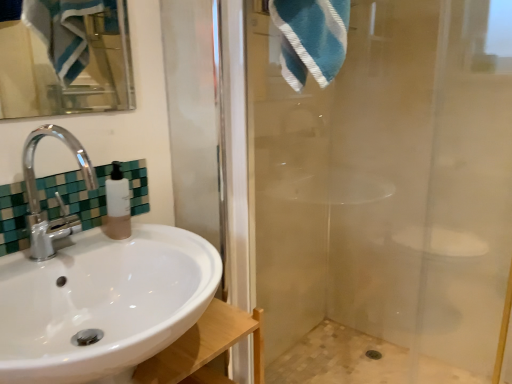
The image size is (512, 384). I want to click on vacant space in front of translucent plastic soap dispenser at sink, so click(85, 253).